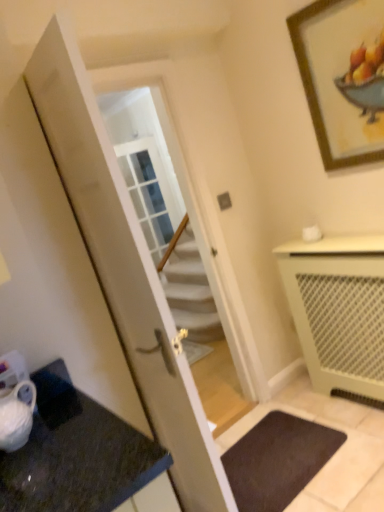
Find the location of a particular element. This screenshot has height=512, width=384. spots to the right of dark brown carpet at lower center is located at coordinates (344, 437).